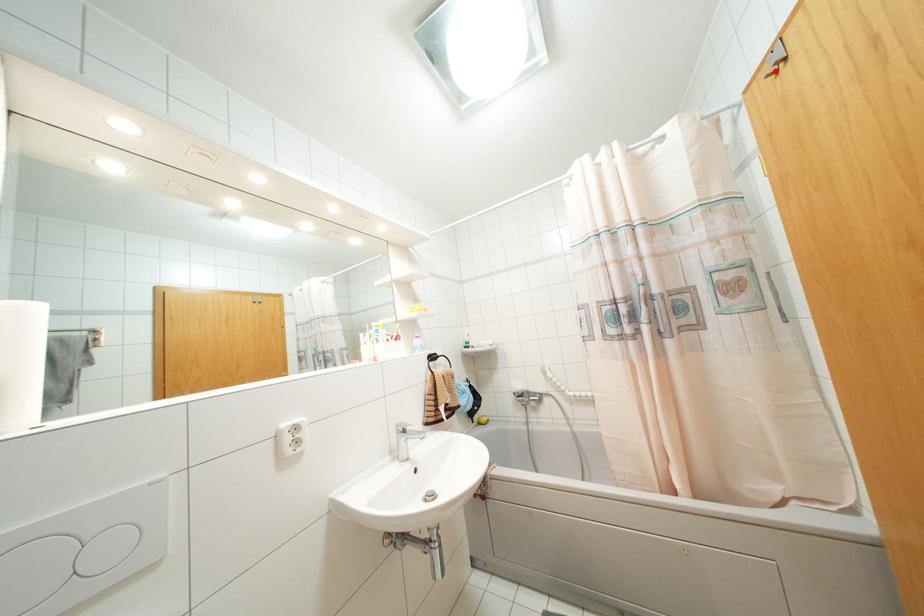
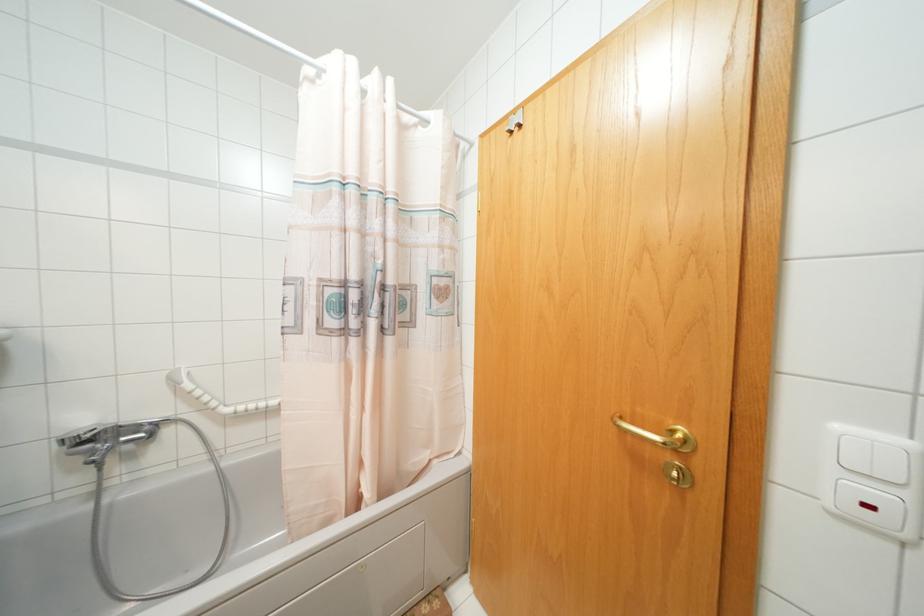
Question: I am providing you with two images of the same scene from different viewpoints. A red point is marked on the first image. At the location where the point appears in image 1, is it still visible in image 2?

Choices:
 (A) Yes
 (B) No

Answer: (A)